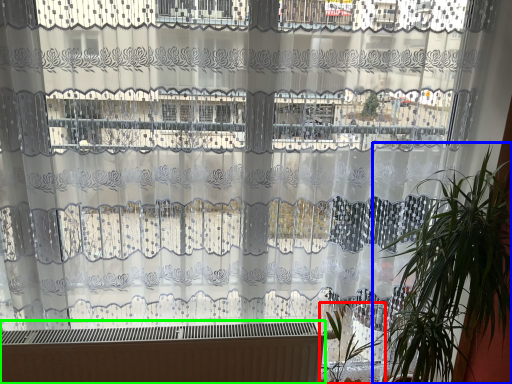
Question: Which is nearer to the vegetation (highlighted by a red box)? houseplant (highlighted by a blue box) or heater (highlighted by a green box).

Choices:
 (A) houseplant
 (B) heater

Answer: (A)